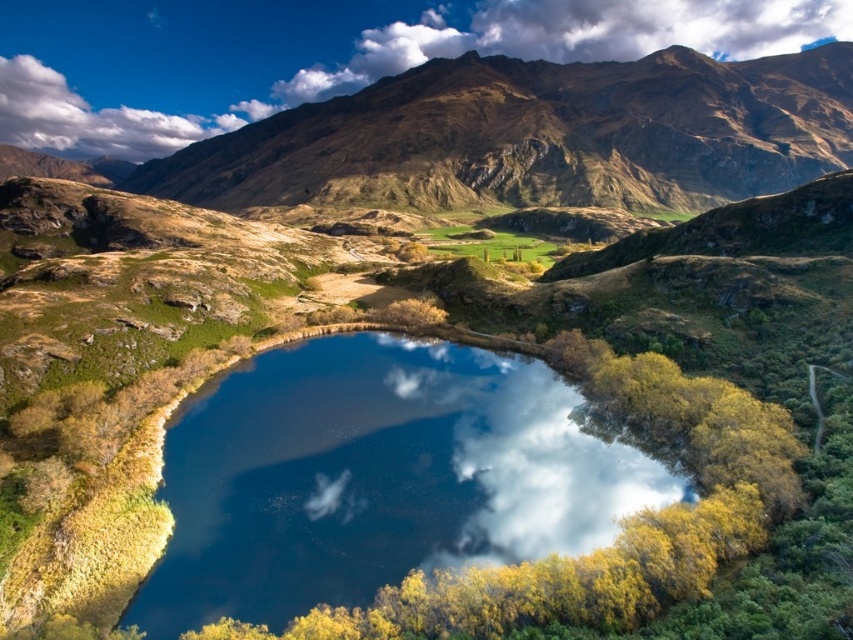
Consider the image. Can you confirm if glossy blue water at center is positioned to the right of white fluffy cloud at upper center?

Indeed, glossy blue water at center is positioned on the right side of white fluffy cloud at upper center.

At what (x,y) coordinates should I click in order to perform the action: click on glossy blue water at center. Please return your answer as a coordinate pair (x, y). The height and width of the screenshot is (640, 853). Looking at the image, I should click on [x=376, y=477].

Where is `glossy blue water at center`? This screenshot has width=853, height=640. glossy blue water at center is located at coordinates (376, 477).

Who is taller, glossy blue water at center or white fluffy cloud at upper left?

white fluffy cloud at upper left

Is glossy blue water at center to the right of white fluffy cloud at upper left from the viewer's perspective?

Indeed, glossy blue water at center is positioned on the right side of white fluffy cloud at upper left.

Between point (207, 580) and point (0, 138), which one is positioned in front?

Positioned in front is point (207, 580).

This screenshot has height=640, width=853. Find the location of `glossy blue water at center`. glossy blue water at center is located at coordinates (376, 477).

Is point (175, 3) positioned behind point (142, 148)?

No, it is in front of (142, 148).

Who is lower down, white fluffy cloud at upper center or white fluffy cloud at upper left?

white fluffy cloud at upper left is below.

Describe the element at coordinates (343, 60) in the screenshot. The width and height of the screenshot is (853, 640). I see `white fluffy cloud at upper center` at that location.

In order to click on white fluffy cloud at upper center in this screenshot , I will do `click(343, 60)`.